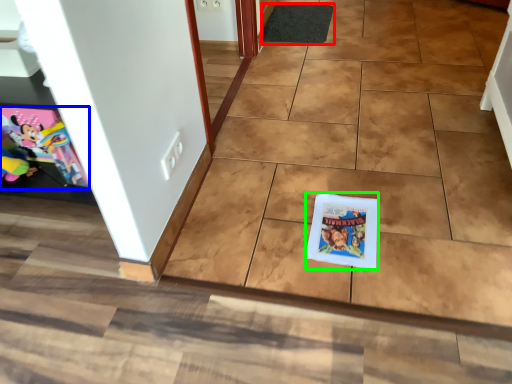
Question: Which is nearer to the doormat (highlighted by a red box)? comic book (highlighted by a blue box) or comic book (highlighted by a green box).

Choices:
 (A) comic book
 (B) comic book

Answer: (B)